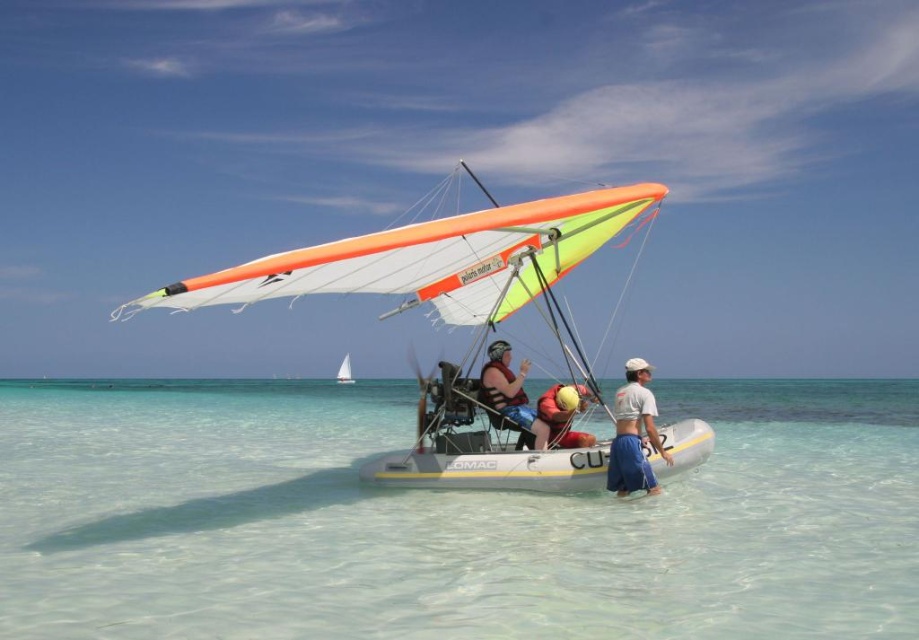
You are a safety inspector checking the setup of the motorized hang glider on the inflatable boat. Based on the scene, is the clear plastic water at center positioned in a way that could interfere with the white sail at center during operation?

The clear plastic water at center is above the white sail at center, which means it is positioned over the sail. This placement could obstruct the sail or cause instability during operation, posing a safety risk.

You are a safety inspector checking the distance between the orange life vest at center and the camera. According to regulations, the minimum safe distance is 10 meters. Is the current distance compliant?

The distance between the orange life vest at center and the camera is 11.89 meters, which exceeds the minimum requirement of 10 meters, so it is compliant.